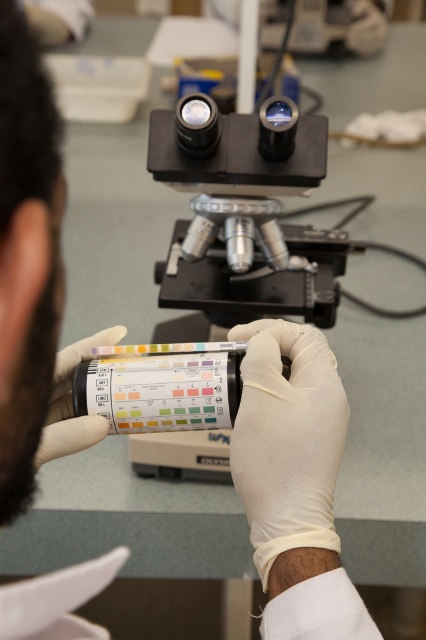
Which is in front, point (195, 440) or point (86, 355)?

Point (86, 355) is in front.

Is metallic silver microscope at center shorter than white matte glove at center?

In fact, metallic silver microscope at center may be taller than white matte glove at center.

Does point (325, 244) come closer to viewer compared to point (48, 449)?

No, (325, 244) is behind (48, 449).

Where is `metallic silver microscope at center`? Image resolution: width=426 pixels, height=640 pixels. metallic silver microscope at center is located at coordinates (244, 212).

Who is lower down, metallic silver microscope at center or white latex glove at center?

Positioned lower is white latex glove at center.

Does metallic silver microscope at center have a greater height compared to white latex glove at center?

Correct, metallic silver microscope at center is much taller as white latex glove at center.

Between point (336, 291) and point (307, 500), which one is positioned behind?

The point (336, 291) is behind.

This screenshot has height=640, width=426. In order to click on metallic silver microscope at center in this screenshot , I will do `click(244, 212)`.

Is point (305, 493) closer to viewer compared to point (69, 368)?

Yes, it is.

Does white latex glove at center lie in front of white matte glove at center?

No, it is behind white matte glove at center.

The image size is (426, 640). I want to click on white latex glove at center, so click(x=288, y=451).